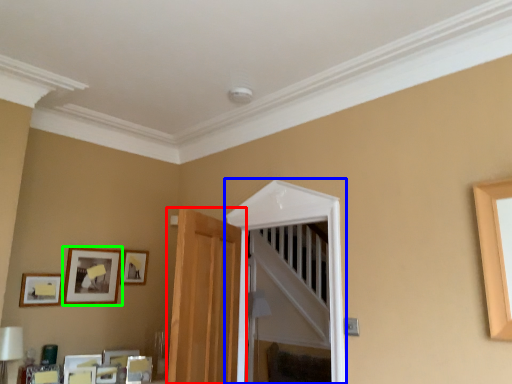
Question: Considering the real-world distances, which object is closest to door (highlighted by a red box)? glass door (highlighted by a blue box) or picture frame (highlighted by a green box).

Choices:
 (A) glass door
 (B) picture frame

Answer: (A)